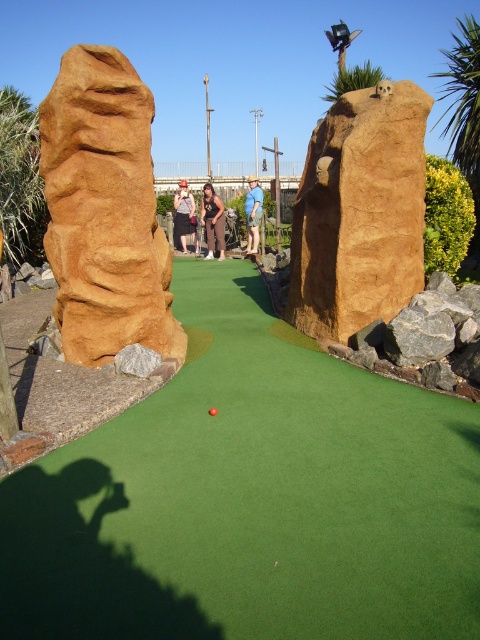
Between brown leather pants at center and matte black shirt at center, which one appears on the left side from the viewer's perspective?

matte black shirt at center is more to the left.

Identify the location of brown leather pants at center. The image size is (480, 640). 213,220.

Does green artificial turf at center have a smaller size compared to matte black shirt at center?

Actually, green artificial turf at center might be larger than matte black shirt at center.

Is point (333, 440) in front of point (188, 189)?

Yes, point (333, 440) is in front of point (188, 189).

Is point (93, 465) closer to viewer compared to point (189, 230)?

Yes, it is in front of point (189, 230).

Locate an element on the screen. green artificial turf at center is located at coordinates 251,499.

Does green artificial turf at center have a larger size compared to brown textured rock at center?

Yes, green artificial turf at center is bigger than brown textured rock at center.

Between green artificial turf at center and brown textured rock at center, which one appears on the right side from the viewer's perspective?

green artificial turf at center is more to the right.

Image resolution: width=480 pixels, height=640 pixels. What do you see at coordinates (251, 499) in the screenshot? I see `green artificial turf at center` at bounding box center [251, 499].

Locate an element on the screen. green artificial turf at center is located at coordinates (251, 499).